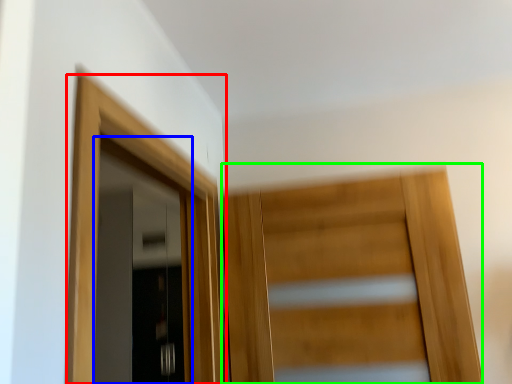
Question: Estimate the real-world distances between objects in this image. Which object is farther from door (highlighted by a red box), door (highlighted by a blue box) or door (highlighted by a green box)?

Choices:
 (A) door
 (B) door

Answer: (A)